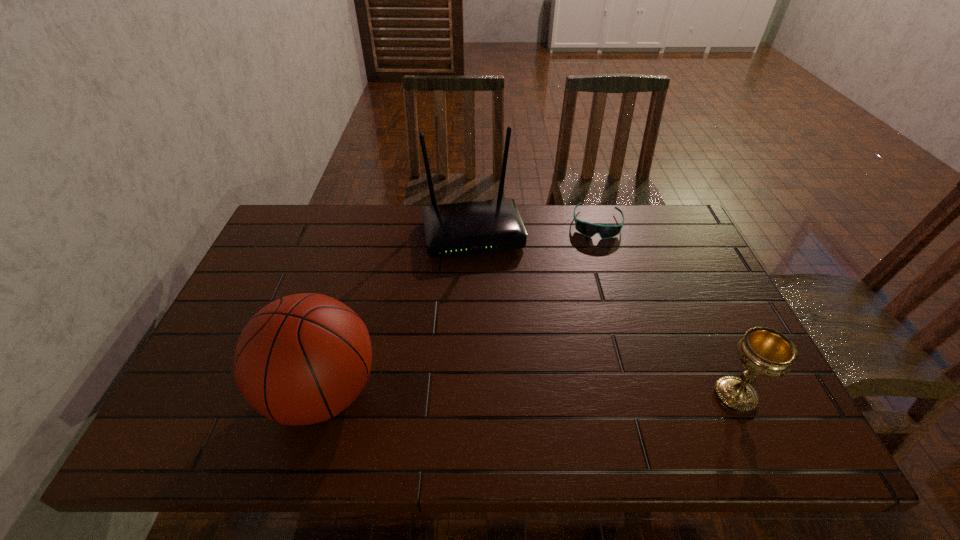
Locate an element on the screen. The height and width of the screenshot is (540, 960). vacant space that's between the second shortest object and the third object from left to right is located at coordinates (666, 309).

The image size is (960, 540). Find the location of `free area in between the leftmost object and the second object from left to right`. free area in between the leftmost object and the second object from left to right is located at coordinates (397, 313).

Locate an element on the screen. Image resolution: width=960 pixels, height=540 pixels. vacant area that lies between the shortest object and the third object from right to left is located at coordinates (535, 228).

Identify the location of empty space that is in between the second object from right to left and the rightmost object. Image resolution: width=960 pixels, height=540 pixels. (666, 309).

Find the location of a particular element. vacant space in between the second shortest object and the router is located at coordinates 604,314.

Where is `free space between the basketball and the second object from left to right`? The width and height of the screenshot is (960, 540). free space between the basketball and the second object from left to right is located at coordinates (397, 313).

Identify the location of object that stands as the closest to the third object from left to right. This screenshot has width=960, height=540. (463, 228).

Identify the location of object that is the third nearest to the leftmost object. The image size is (960, 540). (763, 351).

The height and width of the screenshot is (540, 960). I want to click on free point that satisfies the following two spatial constraints: 1. on the front side of the sunglasses; 2. on the left side of the third tallest object, so click(650, 395).

Image resolution: width=960 pixels, height=540 pixels. Identify the location of vacant space that satisfies the following two spatial constraints: 1. on the back side of the router; 2. on the right side of the shortest object. (473, 224).